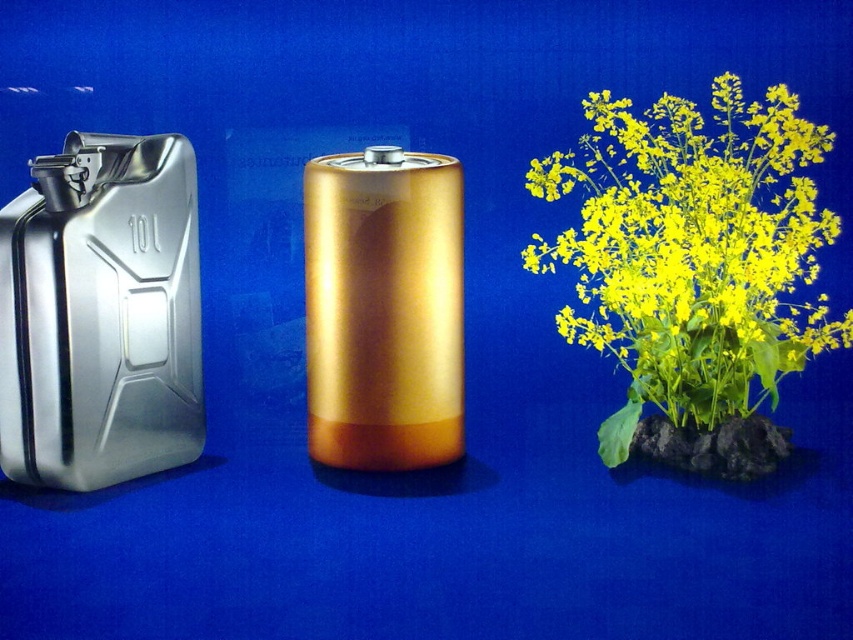
Consider the image. You are arranging plants and containers on a shelf. You have a yellow matte plant at center and a brushed metal canister at left. If you want to place them side by side without overlapping, which one should you place first to ensure they both fit?

Since the yellow matte plant at center is wider than the brushed metal canister at left, you should place the yellow matte plant at center first to accommodate its larger width, then position the brushed metal canister at left next to it.

You are organizing a small garden display and have a yellow matte plant at center and a brushed metal canister at left. Which object should you place in a spot where more sunlight is needed because it requires more space?

The yellow matte plant at center requires more space due to its larger size compared to the brushed metal canister at left, so it should be placed in a sunnier spot where more sunlight is available.

You are arranging flowers in a garden and need to place the yellow matte plant at center and the brushed metal canister at left. According to the image, which object is positioned to the right of the other?

The yellow matte plant at center is to the right of the brushed metal canister at left.